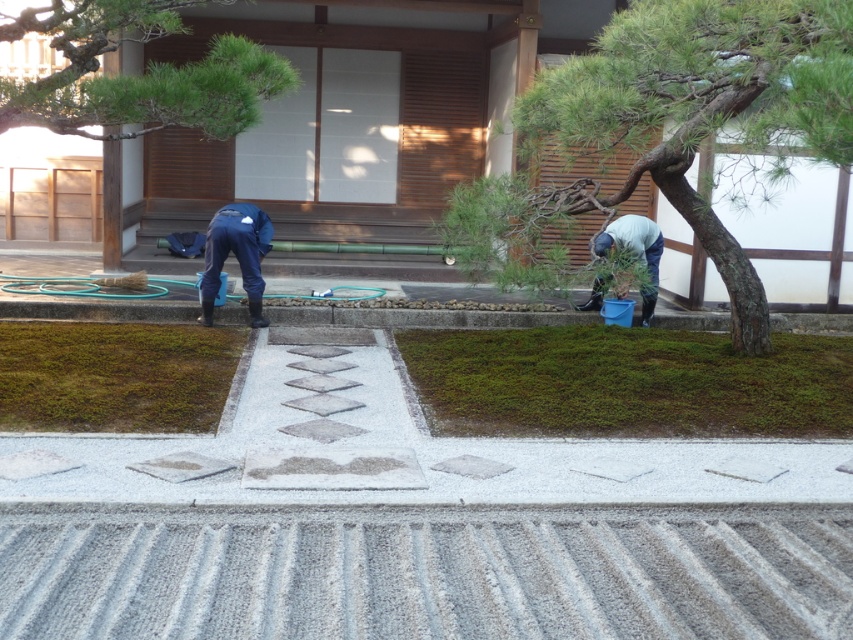
Question: Does blue rubber boots at lower left have a lesser width compared to blue rubber boots at right?

Choices:
 (A) no
 (B) yes

Answer: (B)

Question: Which of the following is the farthest from the observer?

Choices:
 (A) green mossy ground at lower left
 (B) blue rubber boots at lower left

Answer: (B)

Question: Is the position of green mossy grass at center less distant than that of green textured pine tree at upper center?

Choices:
 (A) no
 (B) yes

Answer: (A)

Question: Based on their relative distances, which object is farther from the green mossy ground at lower left?

Choices:
 (A) green textured pine tree at upper center
 (B) green textured tree at center
 (C) blue rubber boots at lower left
 (D) blue rubber boots at right

Answer: (B)

Question: Among these objects, which one is nearest to the camera?

Choices:
 (A) blue rubber boots at lower left
 (B) green mossy ground at lower left
 (C) blue rubber boots at right

Answer: (B)

Question: Can you confirm if green textured pine tree at upper center is positioned above blue rubber boots at right?

Choices:
 (A) yes
 (B) no

Answer: (A)